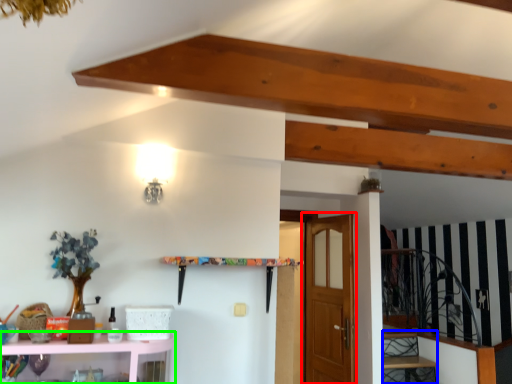
Question: Which object is positioned farthest from door (highlighted by a red box)? Select from stairwell (highlighted by a blue box) and shelf (highlighted by a green box).

Choices:
 (A) stairwell
 (B) shelf

Answer: (B)